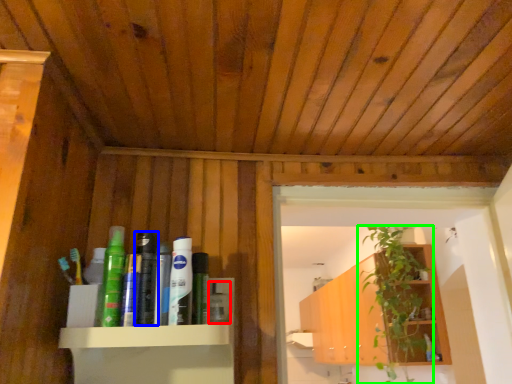
Question: Based on their relative distances, which object is nearer to toiletry (highlighted by a red box)? Choose from toiletry (highlighted by a blue box) and houseplant (highlighted by a green box).

Choices:
 (A) toiletry
 (B) houseplant

Answer: (A)